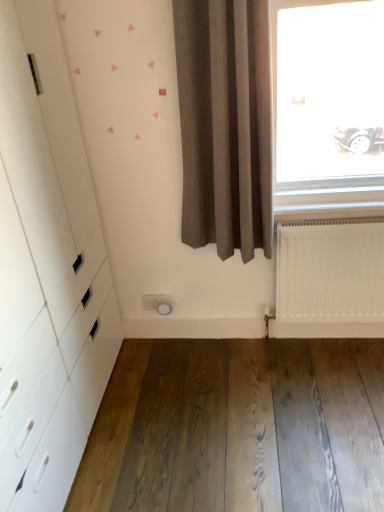
Question: Should I look upward or downward to see brown fabric curtain at center?

Choices:
 (A) down
 (B) up

Answer: (B)

Question: Can you confirm if brown fabric curtain at center is positioned to the left of white matte radiator at lower right?

Choices:
 (A) yes
 (B) no

Answer: (A)

Question: Is brown fabric curtain at center smaller than white matte radiator at lower right?

Choices:
 (A) yes
 (B) no

Answer: (B)

Question: Does brown fabric curtain at center lie in front of white matte radiator at lower right?

Choices:
 (A) yes
 (B) no

Answer: (A)

Question: Considering the relative sizes of brown fabric curtain at center and white matte radiator at lower right in the image provided, is brown fabric curtain at center shorter than white matte radiator at lower right?

Choices:
 (A) no
 (B) yes

Answer: (A)

Question: Is brown fabric curtain at center thinner than white matte radiator at lower right?

Choices:
 (A) yes
 (B) no

Answer: (B)

Question: Is brown fabric curtain at center not within white matte radiator at lower right?

Choices:
 (A) yes
 (B) no

Answer: (A)

Question: Are white matte radiator at lower right and natural wood floor at lower center beside each other?

Choices:
 (A) yes
 (B) no

Answer: (B)

Question: Is white matte radiator at lower right positioned before natural wood floor at lower center?

Choices:
 (A) no
 (B) yes

Answer: (A)

Question: From the image's perspective, is white matte radiator at lower right located above natural wood floor at lower center?

Choices:
 (A) no
 (B) yes

Answer: (B)

Question: Is white matte radiator at lower right wider than natural wood floor at lower center?

Choices:
 (A) no
 (B) yes

Answer: (A)

Question: Is white matte radiator at lower right bigger than natural wood floor at lower center?

Choices:
 (A) yes
 (B) no

Answer: (A)

Question: Could you tell me if white matte radiator at lower right is turned towards natural wood floor at lower center?

Choices:
 (A) yes
 (B) no

Answer: (A)

Question: From the image's perspective, is natural wood floor at lower center located above white glossy dresser at left?

Choices:
 (A) no
 (B) yes

Answer: (A)